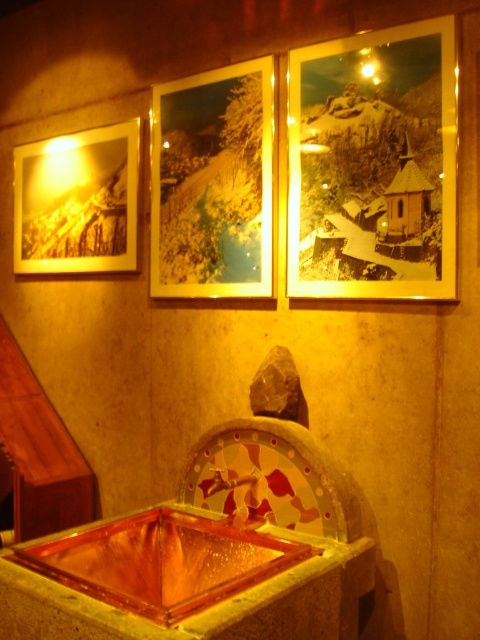
Which is more to the left, gold-framed photo at center or matte paper photo at upper left?

Positioned to the left is matte paper photo at upper left.

I want to click on gold-framed photo at center, so tap(213, 182).

Image resolution: width=480 pixels, height=640 pixels. I want to click on gold-framed photo at center, so (213, 182).

Who is lower down, gold-framed photo at upper right or gold-framed photo at center?

gold-framed photo at upper right is lower down.

Which is more to the left, gold-framed photo at upper right or gold-framed photo at center?

From the viewer's perspective, gold-framed photo at center appears more on the left side.

The height and width of the screenshot is (640, 480). What do you see at coordinates (373, 164) in the screenshot? I see `gold-framed photo at upper right` at bounding box center [373, 164].

Find the location of `gold-framed photo at upper right`. gold-framed photo at upper right is located at coordinates (373, 164).

Is gold-framed photo at upper right wider than matte paper photo at upper left?

No.

Is point (335, 225) positioned behind point (115, 269)?

No, it is in front of (115, 269).

At what (x,y) coordinates should I click in order to perform the action: click on gold-framed photo at upper right. Please return your answer as a coordinate pair (x, y). Image resolution: width=480 pixels, height=640 pixels. Looking at the image, I should click on (373, 164).